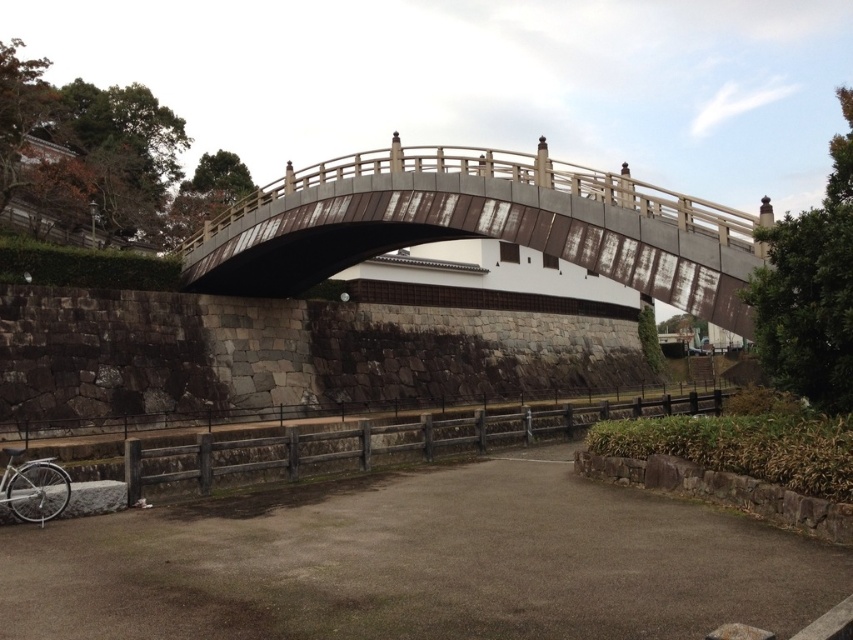
You are standing at the point marked by point (480, 225) in the scene. What is the closest object to you?

The closest object to you is the rusty metal bridge at center, as the point (480, 225) marks its location.

Looking at this image, you are a tourist standing on the dull gray asphalt at center and want to cross the rusty metal bridge at center to reach the other side. Can you walk directly to the bridge from your current position?

The dull gray asphalt at center is in front of rusty metal bridge at center, so yes, you can walk directly to the bridge from your current position on the dull gray asphalt at center.